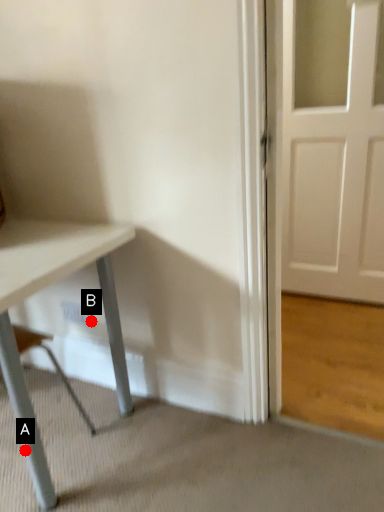
Question: Two points are circled on the image, labeled by A and B beside each circle. Which of the following is the closest to the observer?

Choices:
 (A) A is closer
 (B) B is closer

Answer: (A)